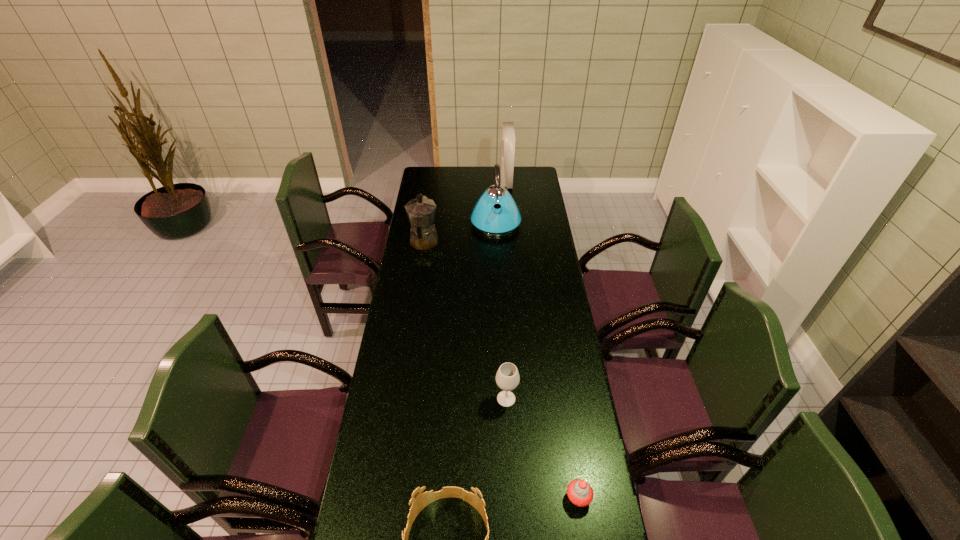
You are a GUI agent. You are given a task and a screenshot of the screen. Output one action in this format:
    pyautogui.click(x=<x>, y=<y>)
    Task: Click on the vacant area at the far edge
    
    Given the screenshot: What is the action you would take?
    pyautogui.click(x=470, y=185)

Where is `free space at the left edge of the desktop`? This screenshot has height=540, width=960. free space at the left edge of the desktop is located at coordinates (442, 198).

Find the location of a particular element. free space at the right edge of the desktop is located at coordinates (568, 470).

Image resolution: width=960 pixels, height=540 pixels. What are the coordinates of `free space at the far left corner` in the screenshot? It's located at (443, 170).

The height and width of the screenshot is (540, 960). What are the coordinates of `free space between the farthest object and the cupcake` in the screenshot? It's located at (542, 340).

Image resolution: width=960 pixels, height=540 pixels. Find the location of `free point between the leftmost object and the third nearest object`. free point between the leftmost object and the third nearest object is located at coordinates (465, 321).

At what (x,y) coordinates should I click in order to perform the action: click on empty space that is in between the leftmost object and the kettle. Please return your answer as a coordinate pair (x, y). Looking at the image, I should click on (460, 233).

The height and width of the screenshot is (540, 960). Identify the location of free space between the shortest object and the kettle. (537, 360).

I want to click on object identified as the third closest to the leftmost object, so click(x=507, y=378).

The image size is (960, 540). I want to click on object that stands as the second closest to the third nearest object, so click(x=420, y=500).